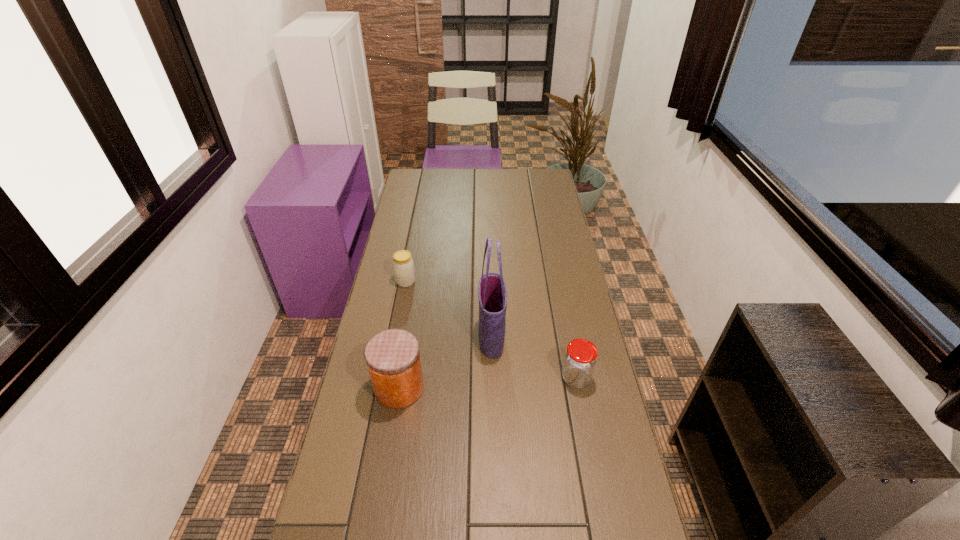
Where is `the third closest object relative to the farthest jar`? The height and width of the screenshot is (540, 960). the third closest object relative to the farthest jar is located at coordinates (580, 358).

Where is `jar that stands as the closest to the third shortest object`? This screenshot has height=540, width=960. jar that stands as the closest to the third shortest object is located at coordinates (403, 265).

The height and width of the screenshot is (540, 960). Find the location of `jar identified as the second closest to the farthest jar`. jar identified as the second closest to the farthest jar is located at coordinates (580, 358).

At what (x,y) coordinates should I click in order to perform the action: click on vacant region that satisfies the following two spatial constraints: 1. on the front side of the farthest jar; 2. on the right side of the rightmost jar. Please return your answer as a coordinate pair (x, y). This screenshot has width=960, height=540. Looking at the image, I should click on (388, 379).

Locate an element on the screen. This screenshot has width=960, height=540. free location that satisfies the following two spatial constraints: 1. on the back side of the tallest object; 2. on the left side of the second tallest object is located at coordinates (407, 337).

This screenshot has width=960, height=540. I want to click on free space that satisfies the following two spatial constraints: 1. on the front side of the farthest object; 2. on the left side of the tallest jar, so click(x=386, y=388).